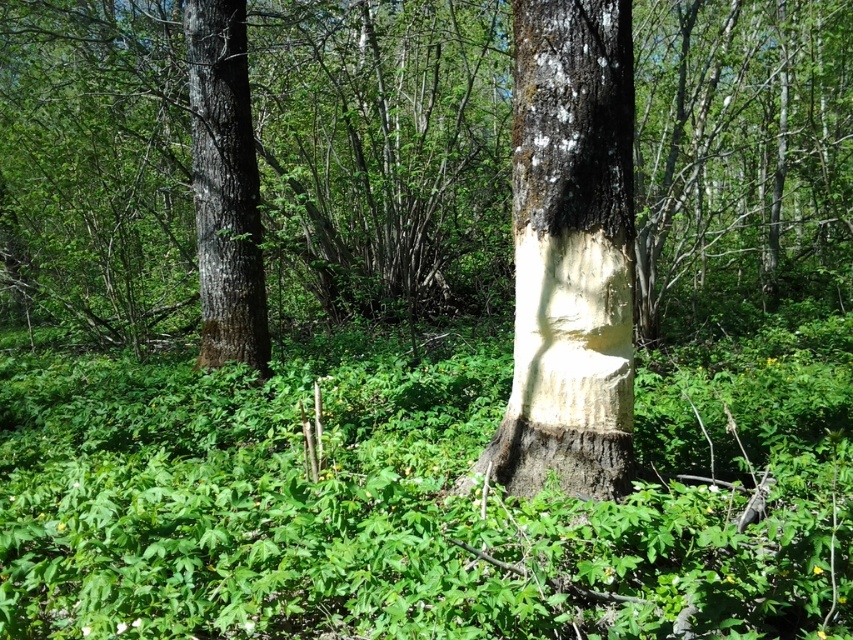
You are a wildlife researcher studying beaver activity. You observe two areas of gnawed bark in the forest scene. One is the smooth white bark at center and the other is the smooth bark tree trunk at left. Based on their widths, which area might require closer inspection for potential damage?

The smooth white bark at center might be wider than the smooth bark tree trunk at left, so it might require closer inspection for potential damage due to its greater width indicating more significant gnawing.

You are a hiker navigating through the forest and want to place a marker at point [567,225] and another marker at point [223,198]. Which marker will be closer to your current position if you are standing at the base of the beaver gnawed tree trunk on the right side of the image?

A: The marker at point [567,225] will be closer to your current position because it is in front of point [223,198], meaning it is nearer to the viewer who is at the base of the tree trunk on the right side.

In the forest scene, there is a prominent tree trunk on the right side that has been gnawed by beavers. The area where the bark has been stripped away is represented by the point at coordinates point (569,253). If you were standing in the forest facing the tree trunk, which direction would the smooth white bark at center be located relative to you?

The smooth white bark at center is represented by point (569,253), which is located at the center of the image. Since the tree trunk is on the right side of the frame, the smooth white bark at center would be to your left relative to the tree trunk when facing it.